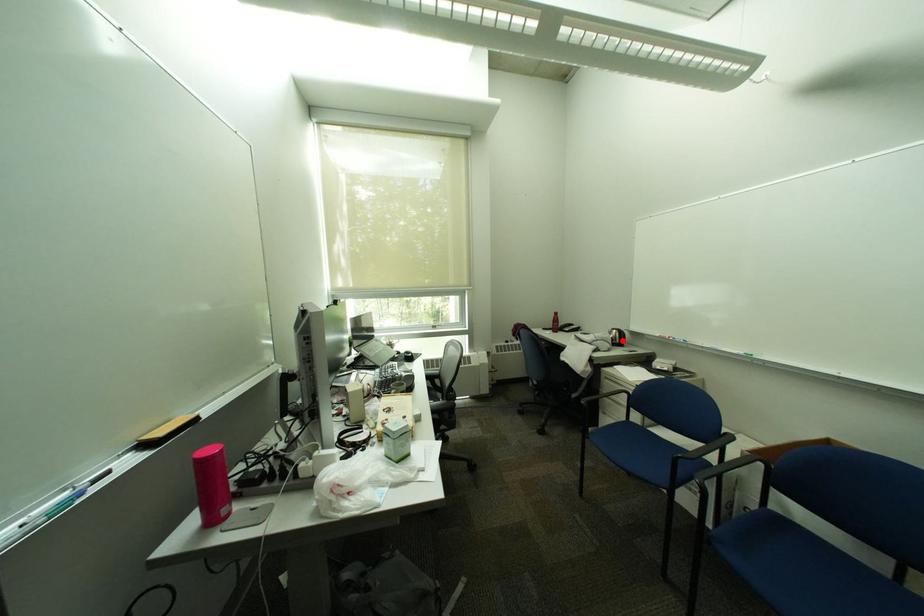
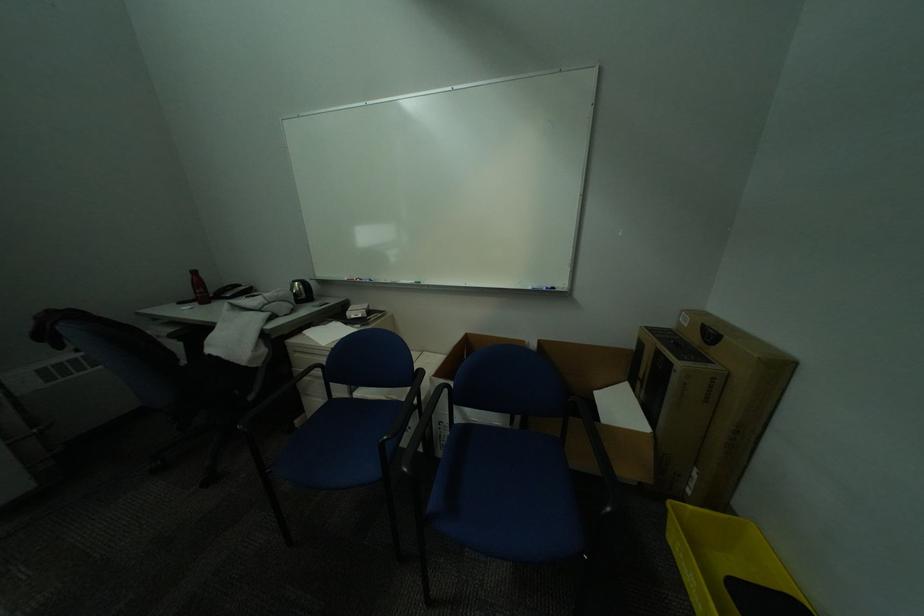
The point at the highlighted location is marked in the first image. Where is the corresponding point in the second image?

(307, 296)